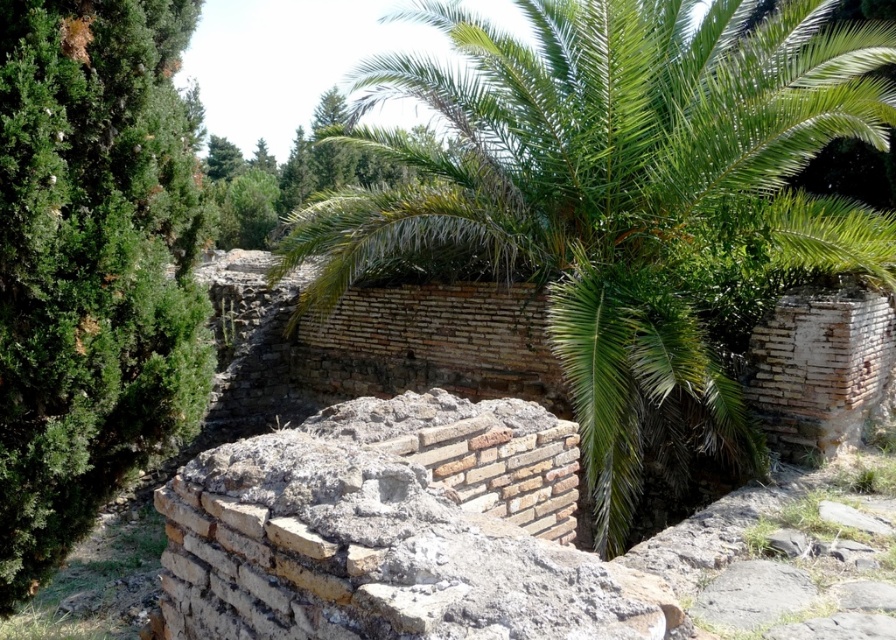
Is green leafy palm at center below green textured tree at left?

No.

Between point (729, 29) and point (112, 161), which one is positioned behind?

Positioned behind is point (729, 29).

Where is `green leafy palm at center`? This screenshot has height=640, width=896. green leafy palm at center is located at coordinates (621, 200).